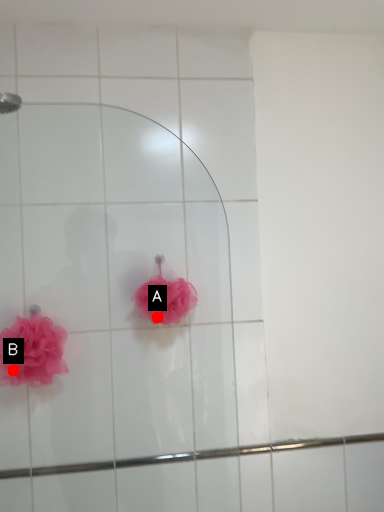
Question: Two points are circled on the image, labeled by A and B beside each circle. Which point appears closest to the camera in this image?

Choices:
 (A) A is closer
 (B) B is closer

Answer: (B)